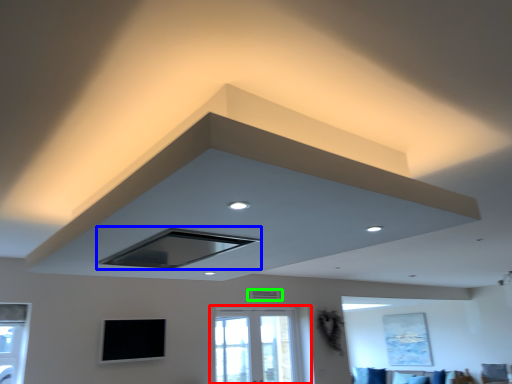
Question: Which object is the closest to the window (highlighted by a red box)? Choose among these: exhaust hood (highlighted by a blue box) or air conditioning (highlighted by a green box).

Choices:
 (A) exhaust hood
 (B) air conditioning

Answer: (B)